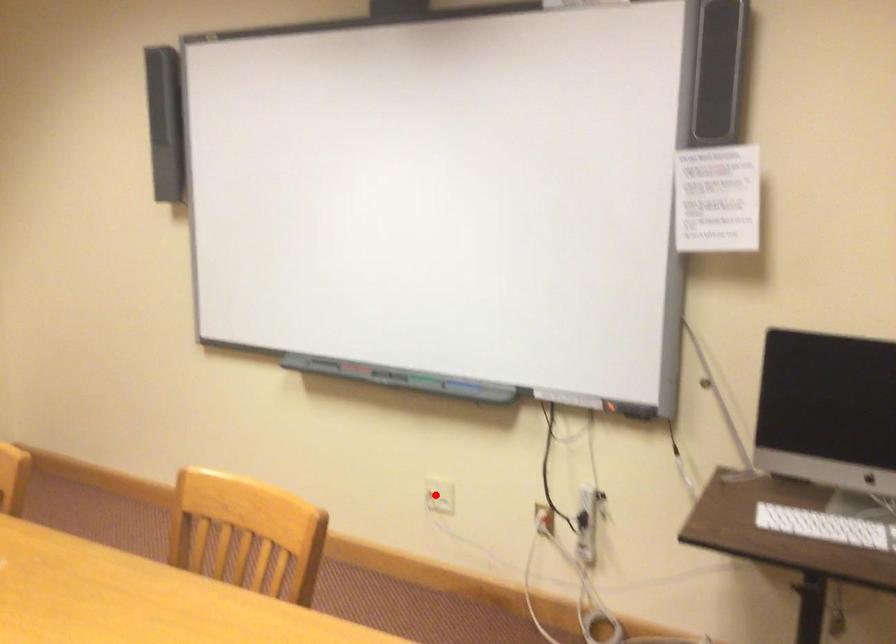
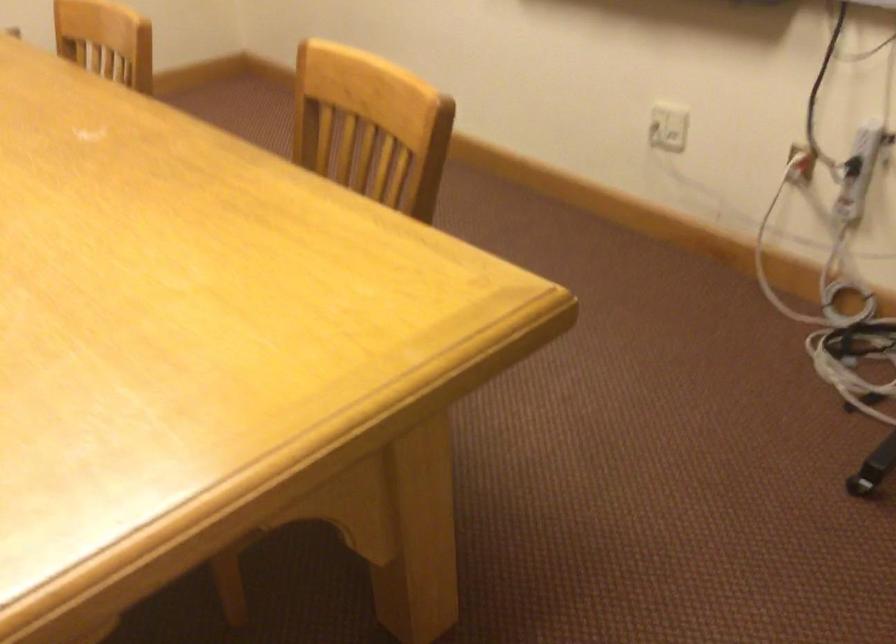
Locate, in the second image, the point that corresponds to the highlighted location in the first image.

(668, 127)